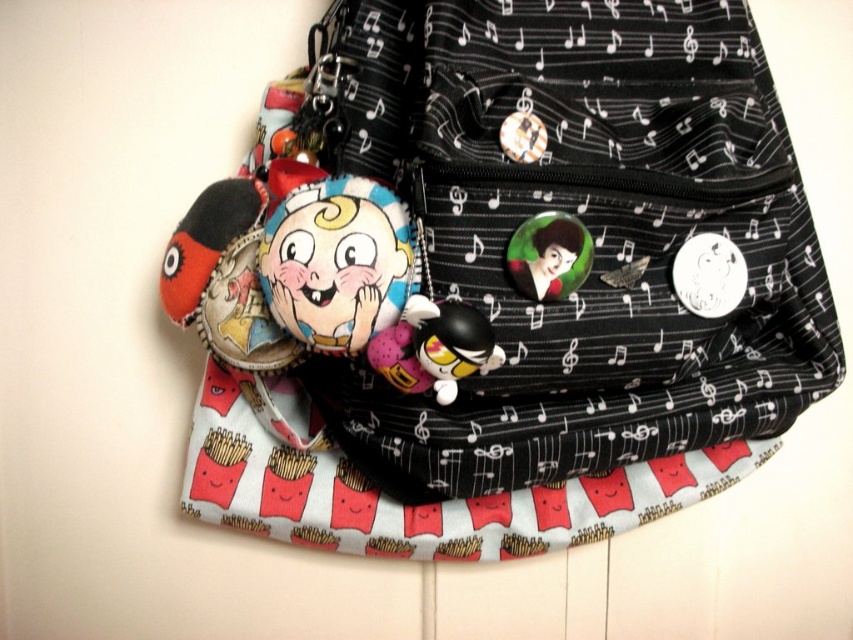
You are trying to fasten the shiny metallic button at center onto the black fabric backpack at center. Based on their positions, can you determine if the button is already attached to the backpack?

The black fabric backpack at center is in front of the shiny metallic button at center, meaning the button is behind the backpack and not attached to it.

You are a delivery person who needs to place a soft plush toy at center and a shiny metallic button at center into a box. The box has a height limit of 10 cm. Can you fit both items vertically without exceeding the height limit?

The soft plush toy at center has a greater height compared to the shiny metallic button at center. If the plush toy alone exceeds 10 cm, then both cannot fit. However, if the combined height of both items is under 10 cm, they can fit. The exact dimensions are needed to determine.

You are organizing a school supply store and need to place the black fabric backpack at center and the soft plush toy at center on a shelf. According to the image, which item is located to the left of the other?

The soft plush toy at center is located to the left of the black fabric backpack at center.